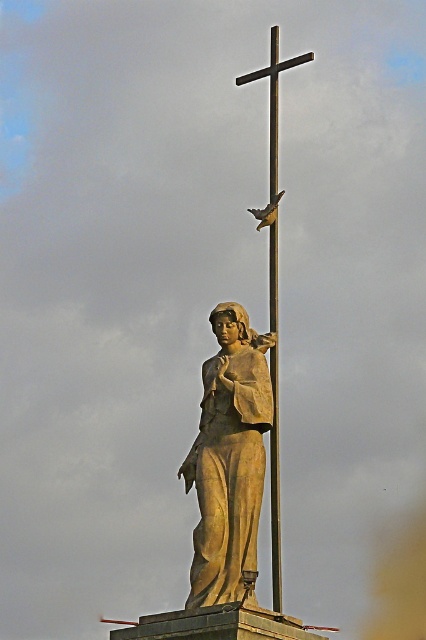
You are a photographer trying to capture a clear photo of the matte bronze statue at center and the matte gray bird at center. Since you want to focus on the statue, which object should you prioritize keeping in the foreground to ensure the statue remains sharp?

The matte bronze statue at center has a greater height compared to the matte gray bird at center. To ensure the statue remains sharp, prioritize keeping the matte bronze statue at center in the foreground since it is taller and likely closer to the camera.

You are an art conservator assessing the statue and the bird in the image. Given that the matte bronze statue at center is made of a heavier material than the matte gray bird at center, which object would require more support to prevent tipping over?

The matte bronze statue at center requires more support to prevent tipping over because it is larger and made of a heavier material than the matte gray bird at center.